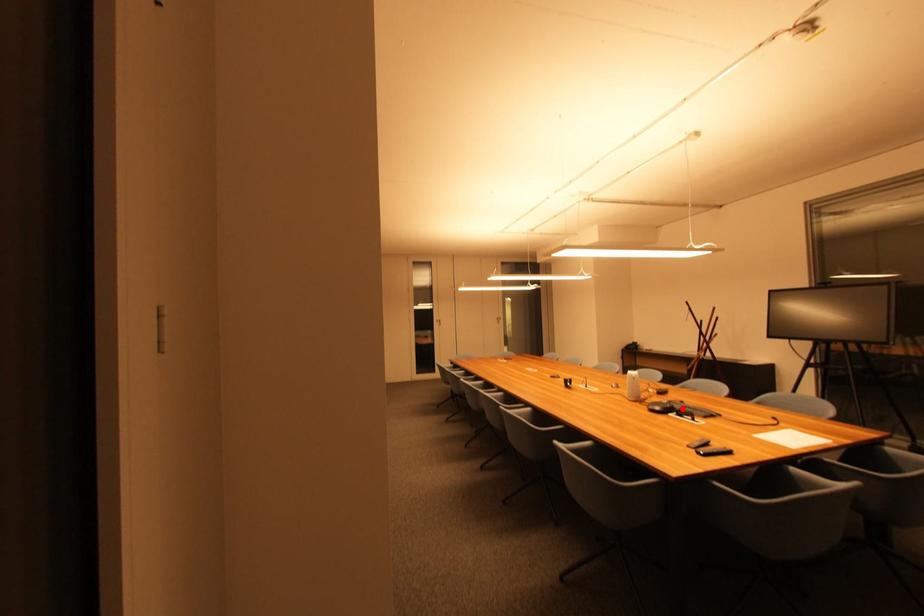
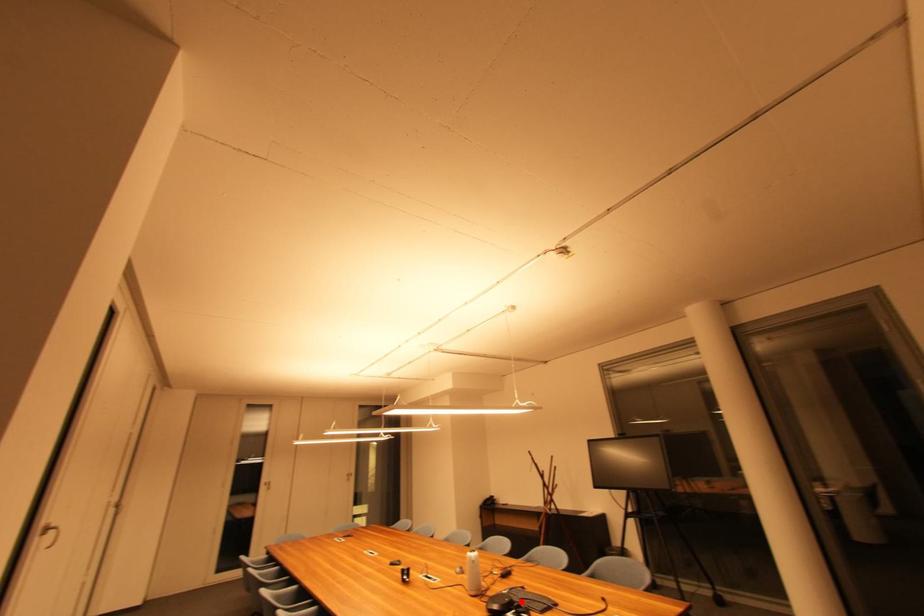
I am providing you with two images of the same scene from different viewpoints. A red point is marked on the first image and another point is marked on the second image. Does the point marked in image1 correspond to the same location as the one in image2?

Yes